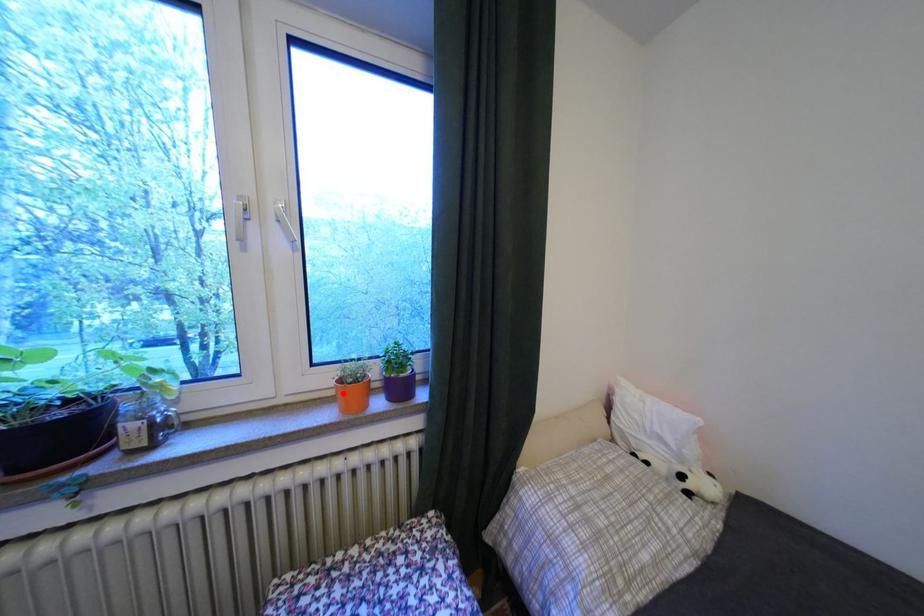
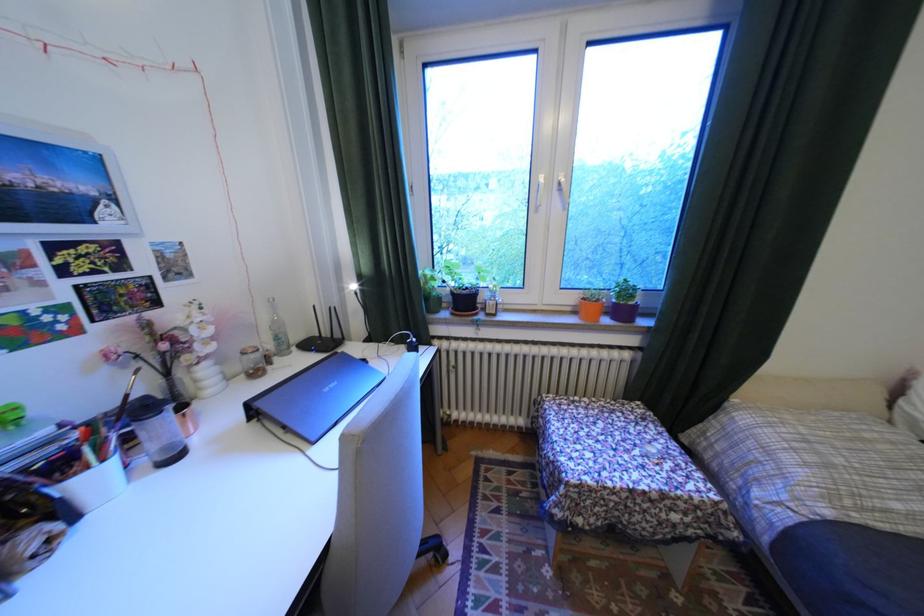
Locate, in the second image, the point that corresponds to the highlighted location in the first image.

(580, 309)